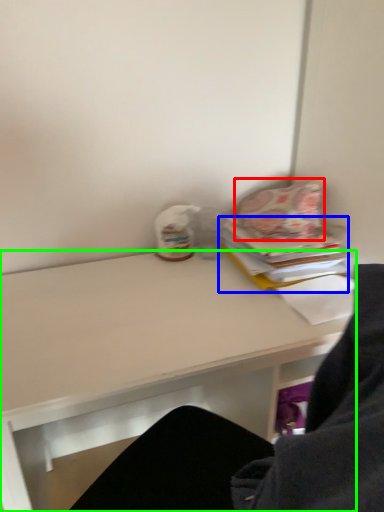
Question: Which object is positioned closest to pillow (highlighted by a red box)? Select from paperback book (highlighted by a blue box) and desk (highlighted by a green box).

Choices:
 (A) paperback book
 (B) desk

Answer: (A)